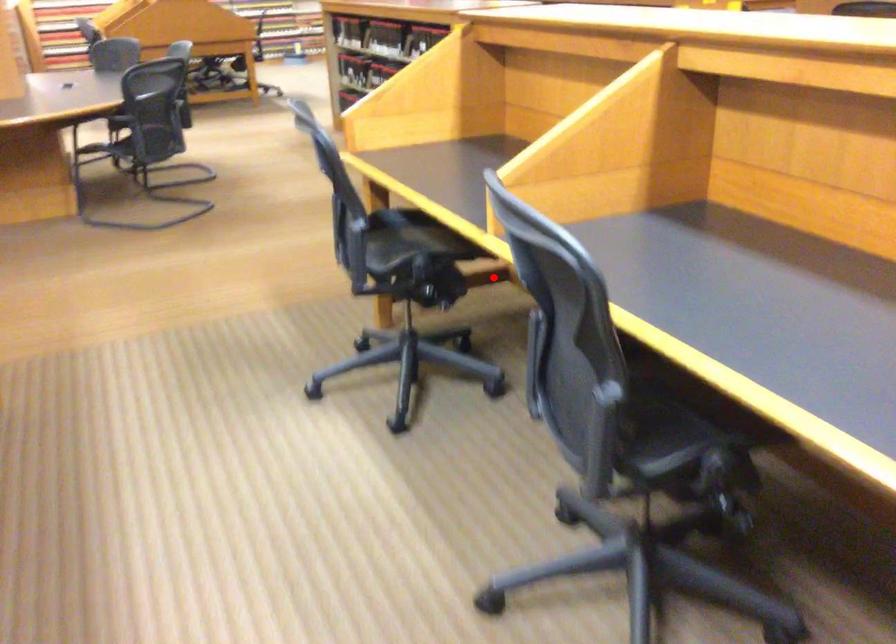
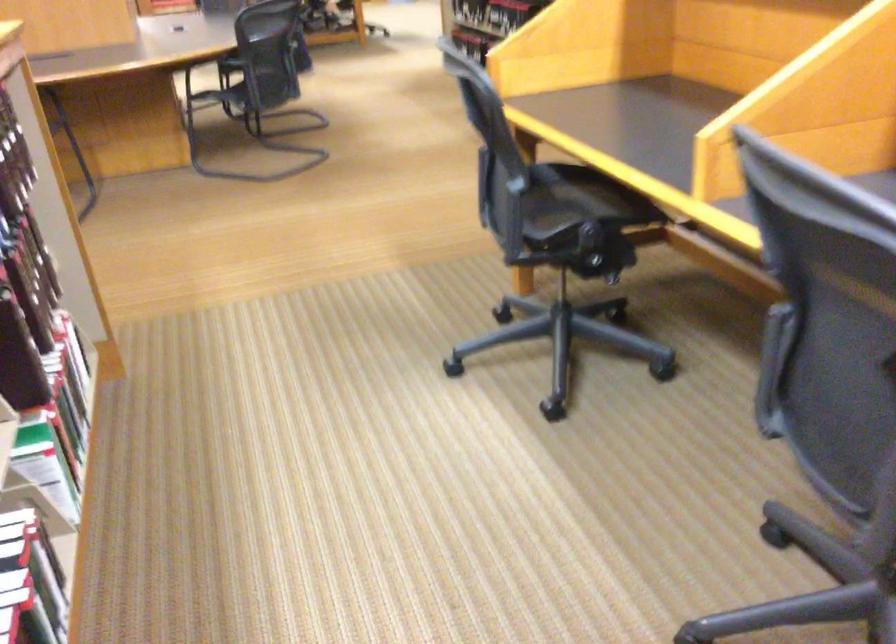
Find the pixel in the second image that matches the highlighted location in the first image.

(648, 237)